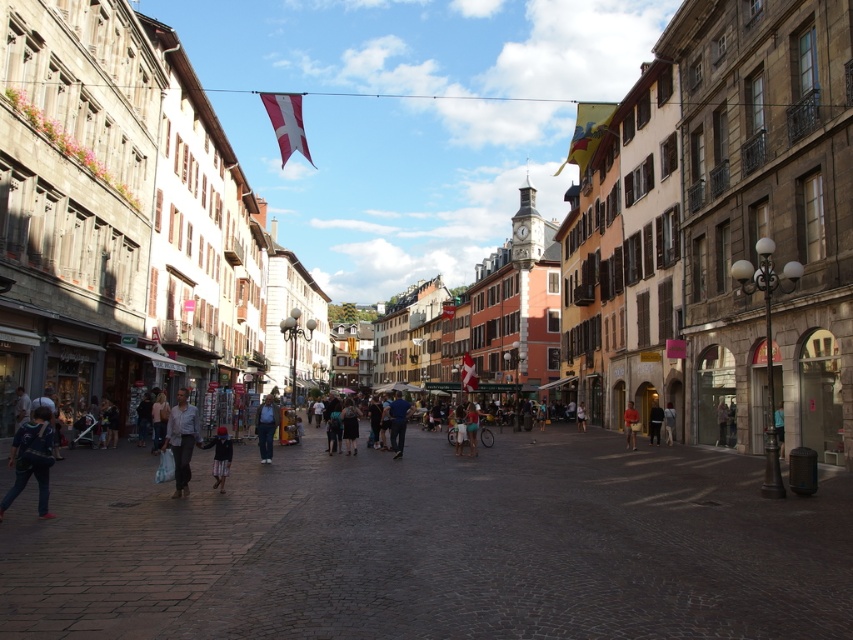
Is point (39, 500) positioned behind point (473, 378)?

No, it is not.

Locate an element on the screen. striped shirt at lower left is located at coordinates (32, 460).

Which is in front, point (154, 570) or point (16, 435)?

Point (154, 570)

Is dark gray cobblestone at center wider than striped shirt at lower left?

Correct, the width of dark gray cobblestone at center exceeds that of striped shirt at lower left.

I want to click on dark gray cobblestone at center, so click(x=431, y=545).

Which of these two, striped shirt at lower left or blue fabric pants at center, stands shorter?

Standing shorter between the two is striped shirt at lower left.

Between point (49, 435) and point (392, 433), which one is positioned behind?

The point (392, 433) is behind.

This screenshot has width=853, height=640. What do you see at coordinates (32, 460) in the screenshot?
I see `striped shirt at lower left` at bounding box center [32, 460].

Locate an element on the screen. The image size is (853, 640). striped shirt at lower left is located at coordinates (32, 460).